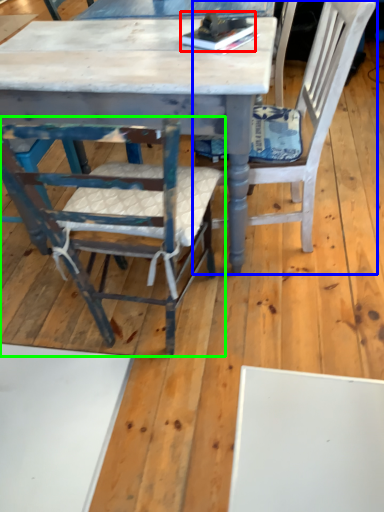
Question: Estimate the real-world distances between objects in this image. Which object is closer to book (highlighted by a red box), chair (highlighted by a blue box) or chair (highlighted by a green box)?

Choices:
 (A) chair
 (B) chair

Answer: (A)